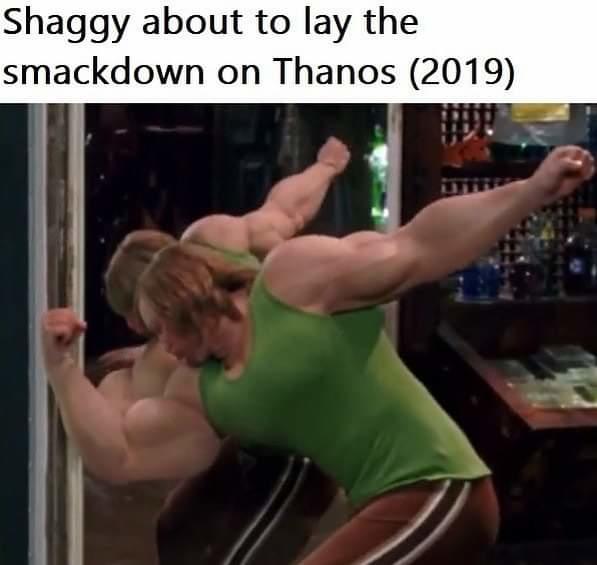
Identify the location of counter. This screenshot has height=565, width=597. (538, 416).